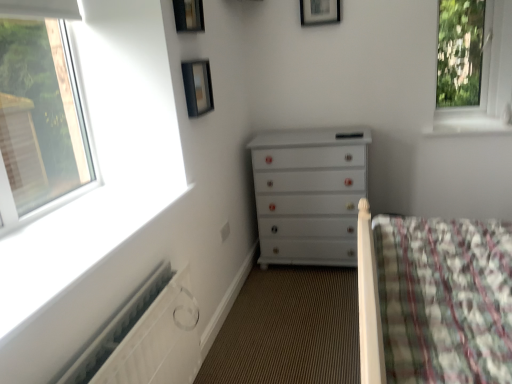
Question: Does black glass picture frame at upper center, the first picture frame viewed from the left, have a greater width compared to white glossy chest of drawers at center?

Choices:
 (A) no
 (B) yes

Answer: (A)

Question: From the image's perspective, is black glass picture frame at upper center, the first picture frame viewed from the left, beneath white glossy chest of drawers at center?

Choices:
 (A) yes
 (B) no

Answer: (B)

Question: From a real-world perspective, is black glass picture frame at upper center, marked as the 3th picture frame in a right-to-left arrangement, positioned under white glossy chest of drawers at center based on gravity?

Choices:
 (A) no
 (B) yes

Answer: (A)

Question: Could you tell me if black glass picture frame at upper center, positioned as the second picture frame in bottom-to-top order, is turned towards white glossy chest of drawers at center?

Choices:
 (A) no
 (B) yes

Answer: (A)

Question: Is black glass picture frame at upper center, which ranks as the 1th picture frame in front-to-back order, outside of white glossy chest of drawers at center?

Choices:
 (A) yes
 (B) no

Answer: (A)

Question: Considering the positions of white glossy window sill at upper right and white glossy chest of drawers at center in the image, is white glossy window sill at upper right bigger or smaller than white glossy chest of drawers at center?

Choices:
 (A) big
 (B) small

Answer: (B)

Question: Considering their positions, is white glossy window sill at upper right located in front of or behind white glossy chest of drawers at center?

Choices:
 (A) front
 (B) behind

Answer: (B)

Question: Looking at their shapes, would you say white glossy window sill at upper right is wider or thinner than white glossy chest of drawers at center?

Choices:
 (A) thin
 (B) wide

Answer: (B)

Question: Is point (425, 130) closer or farther from the camera than point (318, 210)?

Choices:
 (A) farther
 (B) closer

Answer: (A)

Question: Is white textured radiator at lower left wider or thinner than black glass picture frame at upper center, the first picture frame viewed from the left?

Choices:
 (A) wide
 (B) thin

Answer: (A)

Question: Is white textured radiator at lower left spatially inside black glass picture frame at upper center, marked as the second picture frame in a top-to-bottom arrangement, or outside of it?

Choices:
 (A) inside
 (B) outside

Answer: (B)

Question: From a real-world perspective, is white textured radiator at lower left positioned above or below black glass picture frame at upper center, which ranks as the 1th picture frame in front-to-back order?

Choices:
 (A) below
 (B) above

Answer: (A)

Question: In the image, is white textured radiator at lower left positioned in front of or behind black glass picture frame at upper center, marked as the 3th picture frame in a right-to-left arrangement?

Choices:
 (A) front
 (B) behind

Answer: (A)

Question: From a real-world perspective, is black glass picture frame at upper center, which ranks as the 1th picture frame in front-to-back order, physically located above or below white textured radiator at lower left?

Choices:
 (A) above
 (B) below

Answer: (A)

Question: From the image's perspective, is black glass picture frame at upper center, the first picture frame viewed from the left, located above or below white textured radiator at lower left?

Choices:
 (A) above
 (B) below

Answer: (A)